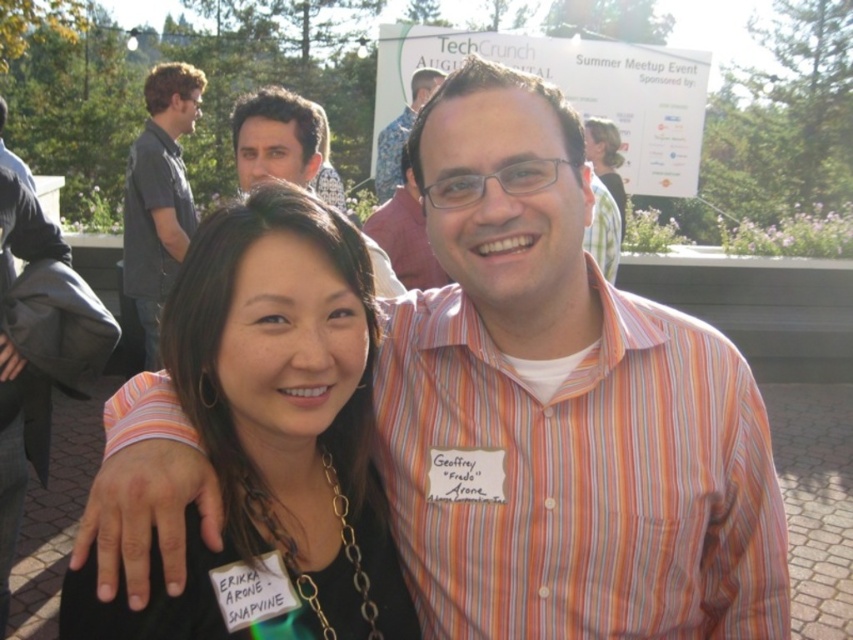
Question: Does striped cotton shirt at center appear on the right side of matte striped shirt at center?

Choices:
 (A) yes
 (B) no

Answer: (A)

Question: Which of these objects is positioned farthest from the matte black shirt at center?

Choices:
 (A) matte striped shirt at center
 (B) black fabric at center
 (C) dark gray shirt at upper left

Answer: (C)

Question: Does striped cotton shirt at center have a lesser width compared to matte pink shirt at center?

Choices:
 (A) no
 (B) yes

Answer: (A)

Question: Which of the following is the farthest from the observer?

Choices:
 (A) (599, 605)
 (B) (143, 310)
 (C) (410, 228)
 (D) (285, 138)

Answer: (B)

Question: Does matte black shirt at center lie in front of matte pink shirt at center?

Choices:
 (A) no
 (B) yes

Answer: (B)

Question: Which of the following is the closest to the observer?

Choices:
 (A) (383, 166)
 (B) (416, 230)
 (C) (148, 321)
 (D) (314, 298)

Answer: (D)